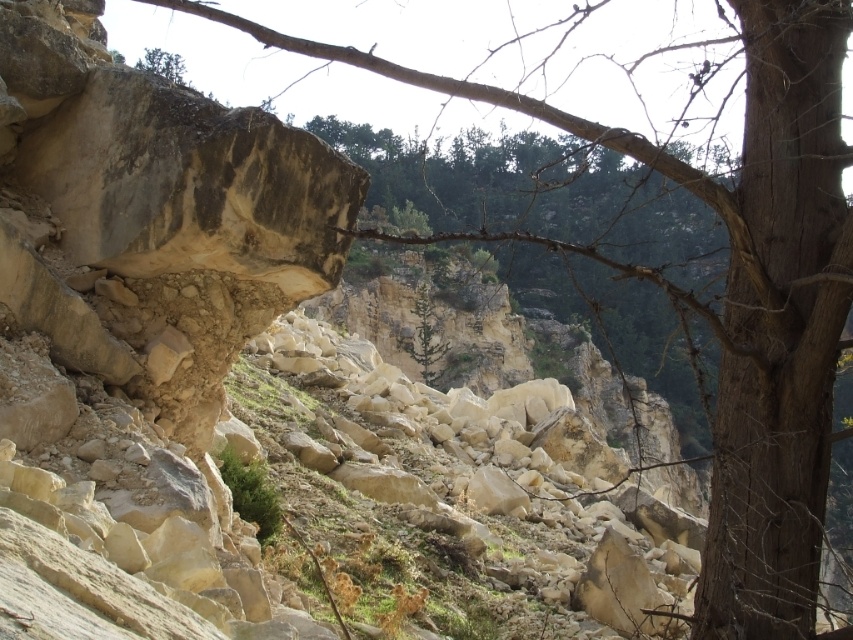
Question: Which of the following is the closest to the observer?

Choices:
 (A) smooth beige rock at center
 (B) green matte tree at center

Answer: (A)

Question: Is smooth beige rock at center behind green matte tree at center?

Choices:
 (A) yes
 (B) no

Answer: (B)

Question: From the image, what is the correct spatial relationship of smooth beige rock at center in relation to green matte tree at center?

Choices:
 (A) left
 (B) right

Answer: (A)

Question: Is smooth beige rock at center closer to camera compared to green matte tree at center?

Choices:
 (A) yes
 (B) no

Answer: (A)